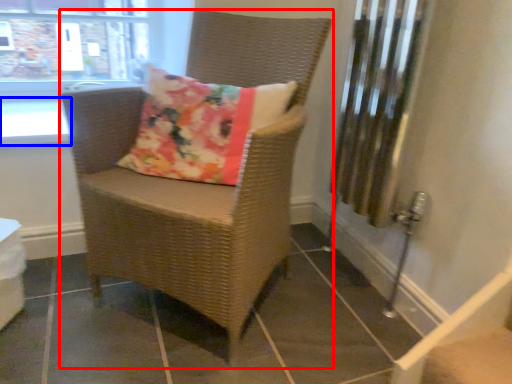
Question: Which of the following is the closest to the observer, chair (highlighted by a red box) or window sill (highlighted by a blue box)?

Choices:
 (A) chair
 (B) window sill

Answer: (A)